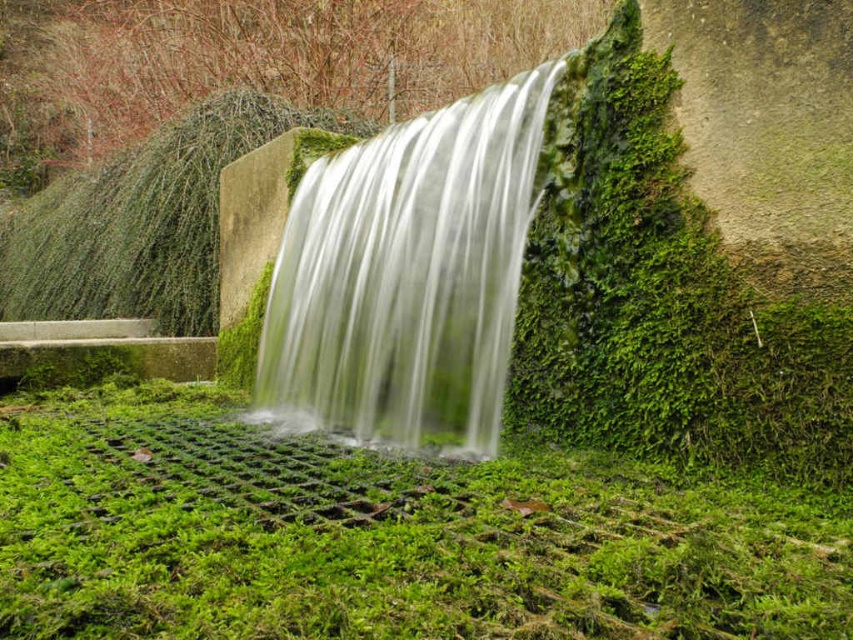
Question: Does green mossy grass at center have a smaller size compared to green mossy waterfall at center?

Choices:
 (A) yes
 (B) no

Answer: (A)

Question: Is green mossy grass at center positioned in front of green mossy waterfall at center?

Choices:
 (A) no
 (B) yes

Answer: (B)

Question: Can you confirm if green mossy grass at center is positioned to the left of green mossy waterfall at center?

Choices:
 (A) no
 (B) yes

Answer: (B)